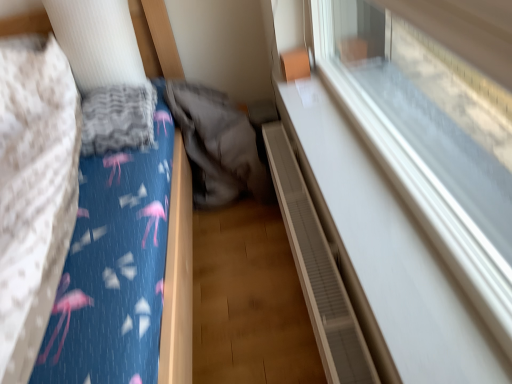
Question: From a real-world perspective, is transparent glass window at upper right above or below blue fabric bed at left?

Choices:
 (A) above
 (B) below

Answer: (A)

Question: From the image's perspective, relative to blue fabric bed at left, is transparent glass window at upper right above or below?

Choices:
 (A) below
 (B) above

Answer: (B)

Question: Considering the real-world distances, which object is farthest from the transparent glass window at upper right?

Choices:
 (A) blue cotton sheet at left
 (B) brown textured radiator at lower right
 (C) blue fabric bed at left
 (D) gray fabric sleeping bag at center

Answer: (A)

Question: Which is nearer to the blue fabric bed at left?

Choices:
 (A) gray fabric sleeping bag at center
 (B) brown textured radiator at lower right
 (C) transparent glass window at upper right
 (D) blue cotton sheet at left

Answer: (A)